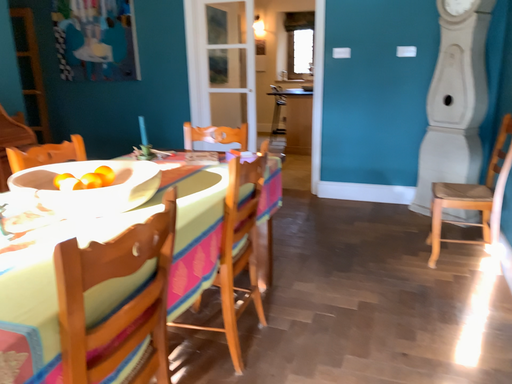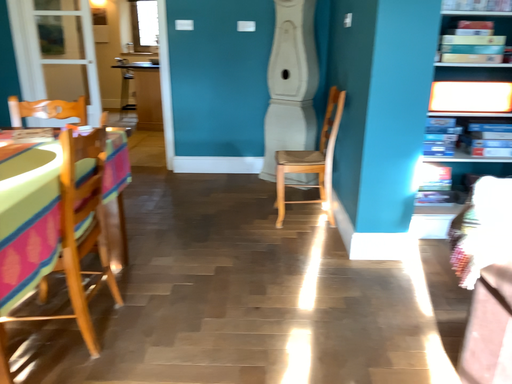
Question: How did the camera likely rotate when shooting the video?

Choices:
 (A) rotated left
 (B) rotated right

Answer: (B)